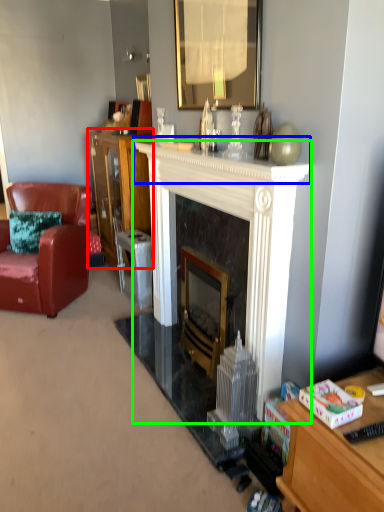
Question: Which object is the farthest from cabinetry (highlighted by a red box)? Choose among these: mantle (highlighted by a blue box) or fireplace (highlighted by a green box).

Choices:
 (A) mantle
 (B) fireplace

Answer: (B)